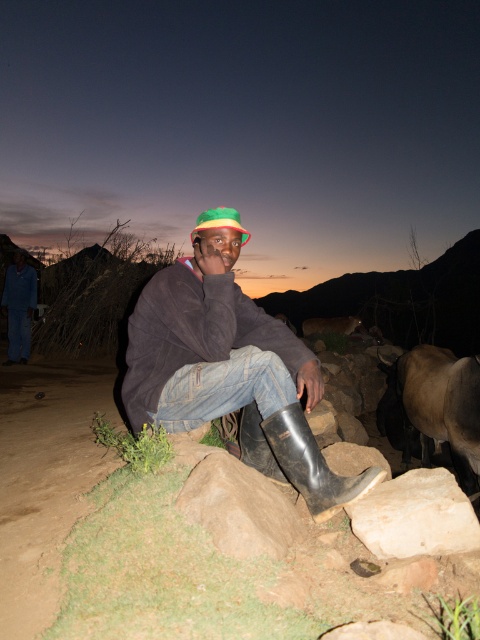
Can you confirm if denim jeans at center is positioned above white smooth rock at lower right?

Yes.

Can you confirm if denim jeans at center is positioned to the left of white smooth rock at lower right?

Yes, denim jeans at center is to the left of white smooth rock at lower right.

What do you see at coordinates (228, 368) in the screenshot? The width and height of the screenshot is (480, 640). I see `denim jeans at center` at bounding box center [228, 368].

Find the location of a particular element. The width and height of the screenshot is (480, 640). denim jeans at center is located at coordinates (228, 368).

Measure the distance between black rubber boot at lower center and camera.

black rubber boot at lower center is 2.09 meters away from camera.

Who is taller, black rubber boot at lower center or multicolored fabric hat at center?

With more height is black rubber boot at lower center.

This screenshot has width=480, height=640. What are the coordinates of `black rubber boot at lower center` in the screenshot? It's located at (312, 465).

Consider the image. Who is taller, white smooth rock at lower right or brown rough rock at lower center?

Standing taller between the two is brown rough rock at lower center.

Based on the photo, how distant is white smooth rock at lower right from brown rough rock at lower center?

white smooth rock at lower right and brown rough rock at lower center are 19.02 inches apart.

Is point (360, 500) farther from viewer compared to point (205, 499)?

Yes, it is.

Find the location of a particular element. Image resolution: width=480 pixels, height=640 pixels. white smooth rock at lower right is located at coordinates (416, 515).